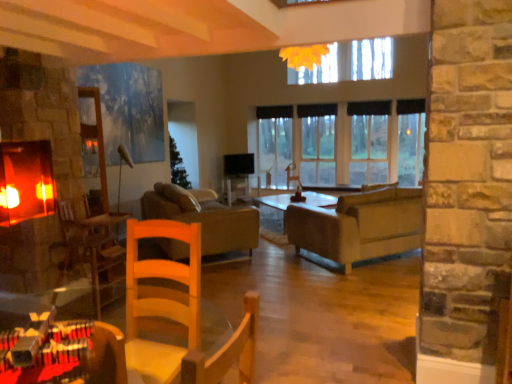
This screenshot has width=512, height=384. What do you see at coordinates (343, 142) in the screenshot?
I see `clear glass window at center` at bounding box center [343, 142].

How much space does brown leather couch at center, the 1th studio couch in the left-to-right sequence, occupy horizontally?

brown leather couch at center, the 1th studio couch in the left-to-right sequence, is 1.12 meters in width.

Measure the distance between wooden armchair at left and camera.

wooden armchair at left is 3.34 meters from camera.

At what (x,y) coordinates should I click in order to perform the action: click on wooden armchair at left. Please return your answer as a coordinate pair (x, y). Looking at the image, I should click on (90, 245).

The image size is (512, 384). I want to click on matte gray couch at center, which is counted as the first studio couch, starting from the right, so click(x=358, y=226).

The width and height of the screenshot is (512, 384). I want to click on the 1st studio couch in front when counting from the clear glass window at center, so click(205, 217).

Between brown leather couch at center, the second studio couch positioned from the right, and clear glass window at center, which one is positioned in front?

brown leather couch at center, the second studio couch positioned from the right, is closer to the camera.

Who is smaller, brown leather couch at center, the 1th studio couch in the left-to-right sequence, or clear glass window at center?

clear glass window at center is smaller.

From a real-world perspective, is brown leather couch at center, the second studio couch positioned from the right, under clear glass window at center?

Correct, in the physical world, brown leather couch at center, the second studio couch positioned from the right, is lower than clear glass window at center.

Find the location of a particular element. This screenshot has width=512, height=384. window behind the wooden table at lower left is located at coordinates (343, 142).

In the image, is wooden table at lower left positioned in front of or behind clear glass window at center?

Clearly, wooden table at lower left is in front of clear glass window at center.

Can you confirm if wooden table at lower left is positioned to the right of clear glass window at center?

In fact, wooden table at lower left is to the left of clear glass window at center.

Does point (385, 175) lie behind point (326, 257)?

Yes, point (385, 175) is behind point (326, 257).

The image size is (512, 384). What are the coordinates of `window that is on the right side of matte gray couch at center, the 2th studio couch positioned from the left` in the screenshot? It's located at (343, 142).

From the image's perspective, is clear glass window at center located beneath matte gray couch at center, which is counted as the first studio couch, starting from the right?

Incorrect, from the image's perspective, clear glass window at center is higher than matte gray couch at center, which is counted as the first studio couch, starting from the right.

Is clear glass window at center to the left of matte gray couch at center, the 2th studio couch positioned from the left, from the viewer's perspective?

Incorrect, clear glass window at center is not on the left side of matte gray couch at center, the 2th studio couch positioned from the left.

Between matte gray couch at center, the 2th studio couch positioned from the left, and brown leather couch at center, the 1th studio couch in the left-to-right sequence, which one has larger width?

matte gray couch at center, the 2th studio couch positioned from the left, is wider.

Could you tell me if matte gray couch at center, the 2th studio couch positioned from the left, is facing brown leather couch at center, the 1th studio couch in the left-to-right sequence?

No, matte gray couch at center, the 2th studio couch positioned from the left, does not turn towards brown leather couch at center, the 1th studio couch in the left-to-right sequence.

Can you confirm if matte gray couch at center, which is counted as the first studio couch, starting from the right, is bigger than brown leather couch at center, the 1th studio couch in the left-to-right sequence?

Incorrect, matte gray couch at center, which is counted as the first studio couch, starting from the right, is not larger than brown leather couch at center, the 1th studio couch in the left-to-right sequence.

Is matte gray couch at center, the 2th studio couch positioned from the left, directly adjacent to brown leather couch at center, the second studio couch positioned from the right?

No, matte gray couch at center, the 2th studio couch positioned from the left, is not next to brown leather couch at center, the second studio couch positioned from the right.

From a real-world perspective, is wooden table at lower left over matte gray couch at center, the 2th studio couch positioned from the left?

Yes.

Where is `table in front of the matte gray couch at center, the 2th studio couch positioned from the left`? The width and height of the screenshot is (512, 384). table in front of the matte gray couch at center, the 2th studio couch positioned from the left is located at coordinates (65, 354).

Is matte gray couch at center, which is counted as the first studio couch, starting from the right, at the back of wooden table at lower left?

No, wooden table at lower left is not facing the opposite direction of matte gray couch at center, which is counted as the first studio couch, starting from the right.

Does point (105, 328) come in front of point (306, 244)?

Yes, point (105, 328) is in front of point (306, 244).

Between brown leather couch at center, the 1th studio couch in the left-to-right sequence, and matte gray couch at center, the 2th studio couch positioned from the left, which one has smaller width?

brown leather couch at center, the 1th studio couch in the left-to-right sequence, is thinner.

Which object is closer to the camera, brown leather couch at center, the second studio couch positioned from the right, or matte gray couch at center, which is counted as the first studio couch, starting from the right?

matte gray couch at center, which is counted as the first studio couch, starting from the right, is in front.

How far apart are brown leather couch at center, the 1th studio couch in the left-to-right sequence, and matte gray couch at center, which is counted as the first studio couch, starting from the right?

brown leather couch at center, the 1th studio couch in the left-to-right sequence, is 3.60 feet from matte gray couch at center, which is counted as the first studio couch, starting from the right.

Considering the relative positions of wooden armchair at left and matte gray couch at center, which is counted as the first studio couch, starting from the right, in the image provided, is wooden armchair at left behind matte gray couch at center, which is counted as the first studio couch, starting from the right,?

No, wooden armchair at left is closer to the camera.

Does point (69, 202) appear closer or farther from the camera than point (369, 246)?

Clearly, point (69, 202) is closer to the camera than point (369, 246).

From the image's perspective, is wooden armchair at left beneath matte gray couch at center, which is counted as the first studio couch, starting from the right?

Yes, from the image's perspective, wooden armchair at left is below matte gray couch at center, which is counted as the first studio couch, starting from the right.

What's the angular difference between wooden armchair at left and matte gray couch at center, the 2th studio couch positioned from the left,'s facing directions?

The angle between the facing direction of wooden armchair at left and the facing direction of matte gray couch at center, the 2th studio couch positioned from the left, is 140 degrees.

Identify the location of the 1st studio couch in front of the clear glass window at center. This screenshot has width=512, height=384. (205, 217).

Identify the location of table lying below the clear glass window at center (from the image's perspective). (65, 354).

Based on their spatial positions, is brown leather couch at center, the second studio couch positioned from the right, or wooden armchair at left closer to matte gray couch at center, the 2th studio couch positioned from the left?

Among the two, brown leather couch at center, the second studio couch positioned from the right, is located nearer to matte gray couch at center, the 2th studio couch positioned from the left.

Looking at the image, which one is located further to wooden armchair at left, wooden table at lower left or clear glass window at center?

The object further to wooden armchair at left is clear glass window at center.

In the scene shown: Estimate the real-world distances between objects in this image. Which object is further from wooden armchair at left, matte gray couch at center, which is counted as the first studio couch, starting from the right, or clear glass window at center?

The object further to wooden armchair at left is clear glass window at center.

Based on their spatial positions, is matte gray couch at center, which is counted as the first studio couch, starting from the right, or wooden armchair at left further from brown leather couch at center, the second studio couch positioned from the right?

matte gray couch at center, which is counted as the first studio couch, starting from the right, is positioned further to the anchor brown leather couch at center, the second studio couch positioned from the right.

When comparing their distances from matte gray couch at center, the 2th studio couch positioned from the left, does wooden table at lower left or wooden armchair at left seem further?

Among the two, wooden table at lower left is located further to matte gray couch at center, the 2th studio couch positioned from the left.

When comparing their distances from brown leather couch at center, the second studio couch positioned from the right, does wooden armchair at left or wooden table at lower left seem closer?

wooden armchair at left is positioned closer to the anchor brown leather couch at center, the second studio couch positioned from the right.

Which object lies further to the anchor point wooden table at lower left, brown leather couch at center, the 1th studio couch in the left-to-right sequence, or clear glass window at center?

clear glass window at center lies further to wooden table at lower left than the other object.

When comparing their distances from brown leather couch at center, the second studio couch positioned from the right, does wooden table at lower left or clear glass window at center seem closer?

Among the two, clear glass window at center is located nearer to brown leather couch at center, the second studio couch positioned from the right.

Locate an element on the screen. studio couch between wooden armchair at left and matte gray couch at center, the 2th studio couch positioned from the left, from left to right is located at coordinates (205, 217).

Find the location of a particular element. The image size is (512, 384). armchair positioned between wooden table at lower left and clear glass window at center from near to far is located at coordinates (90, 245).

This screenshot has width=512, height=384. I want to click on studio couch positioned between matte gray couch at center, the 2th studio couch positioned from the left, and clear glass window at center from near to far, so click(205, 217).

You are a GUI agent. You are given a task and a screenshot of the screen. Output one action in this format:
    pyautogui.click(x=<x>, y=<y>)
    Task: Click on the studio couch positioned between wooden table at lower left and brown leather couch at center, the 1th studio couch in the left-to-right sequence, from near to far
    The image size is (512, 384).
    Given the screenshot: What is the action you would take?
    pyautogui.click(x=358, y=226)